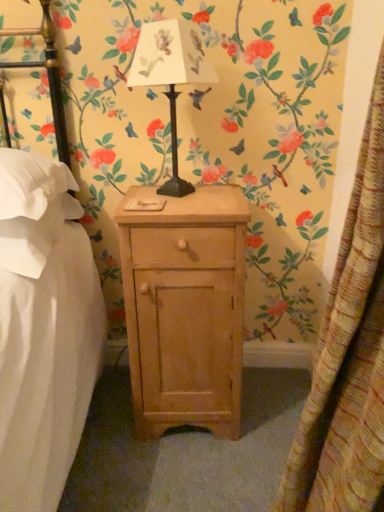
Where is `free space in front of light wood nightstand at center`? The height and width of the screenshot is (512, 384). free space in front of light wood nightstand at center is located at coordinates (182, 476).